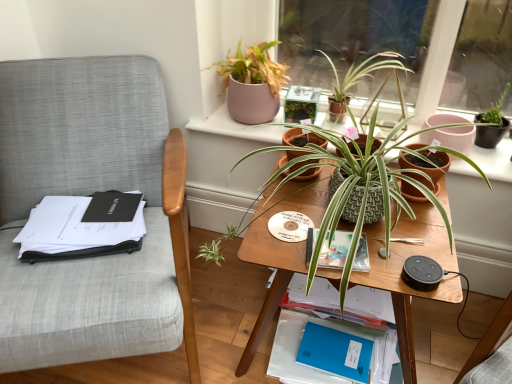
The width and height of the screenshot is (512, 384). I want to click on vacant area that is situated to the right of blue matte paperback book at lower center, which ranks as the 2th paperback book in top-to-bottom order, so click(381, 351).